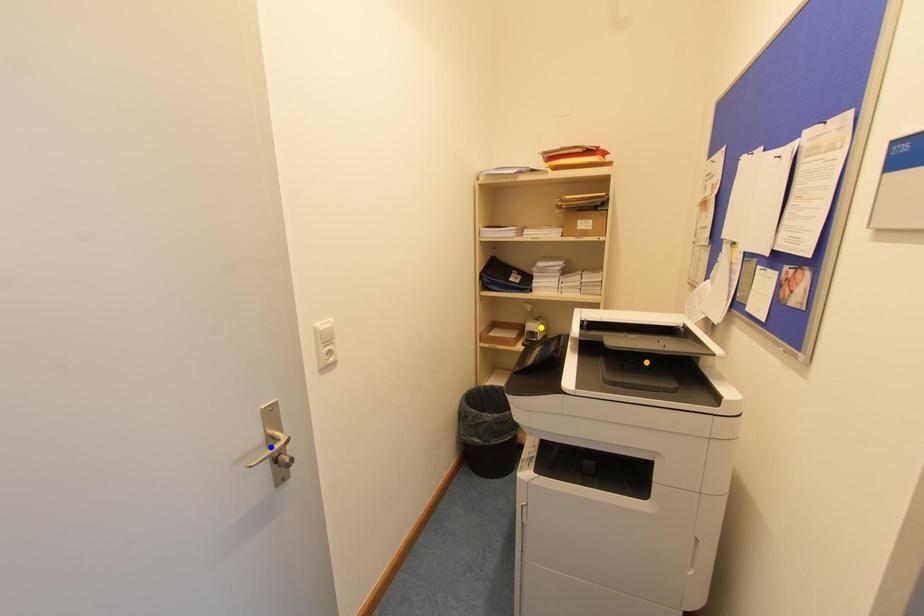
Order these from nearest to farthest:
yellow point, orange point, blue point

blue point, orange point, yellow point